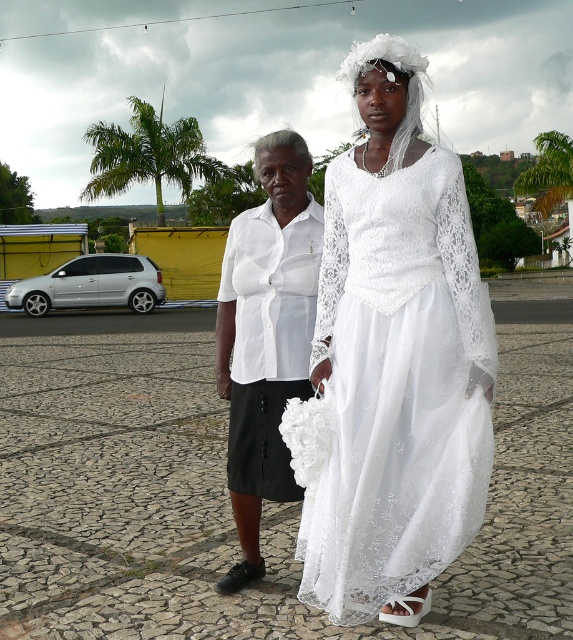
You are a photographer standing at the origin point of the coordinate system. You need to capture a photo of the white lace dress at center located at point (393, 362). What is the exact coordinate point where the white lace dress at center is positioned?

The white lace dress at center is located at point (393, 362).

You are a photographer setting up for a photoshoot. You need to ensure that the white lace dress at center and the white cotton blouse at center are visible in the frame. Based on their positions, which one should you focus on first to capture both in the photo?

The white lace dress at center is above the white cotton blouse at center, so focusing on the white lace dress at center first will help ensure both are in the frame.